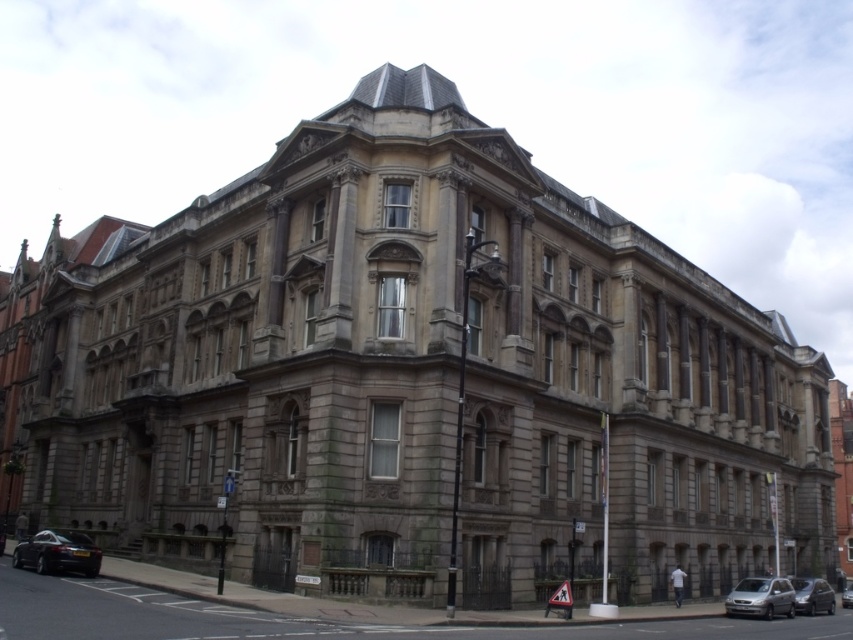
Question: Which point is closer to the camera?

Choices:
 (A) metallic silver car at center
 (B) metallic silver car at lower right
 (C) silver metallic van at lower right
 (D) shiny black car at lower left

Answer: (D)

Question: Does silver metallic van at lower right appear on the right side of metallic silver car at lower right?

Choices:
 (A) yes
 (B) no

Answer: (B)

Question: Does shiny black car at lower left appear under metallic silver car at center?

Choices:
 (A) yes
 (B) no

Answer: (B)

Question: Which object appears closest to the camera in this image?

Choices:
 (A) metallic silver car at center
 (B) metallic silver car at lower right
 (C) shiny black car at lower left
 (D) silver metallic van at lower right

Answer: (C)

Question: In this image, where is silver metallic van at lower right located relative to metallic silver car at lower right?

Choices:
 (A) below
 (B) above

Answer: (B)

Question: Which object appears farthest from the camera in this image?

Choices:
 (A) metallic silver car at lower right
 (B) shiny black car at lower left

Answer: (A)